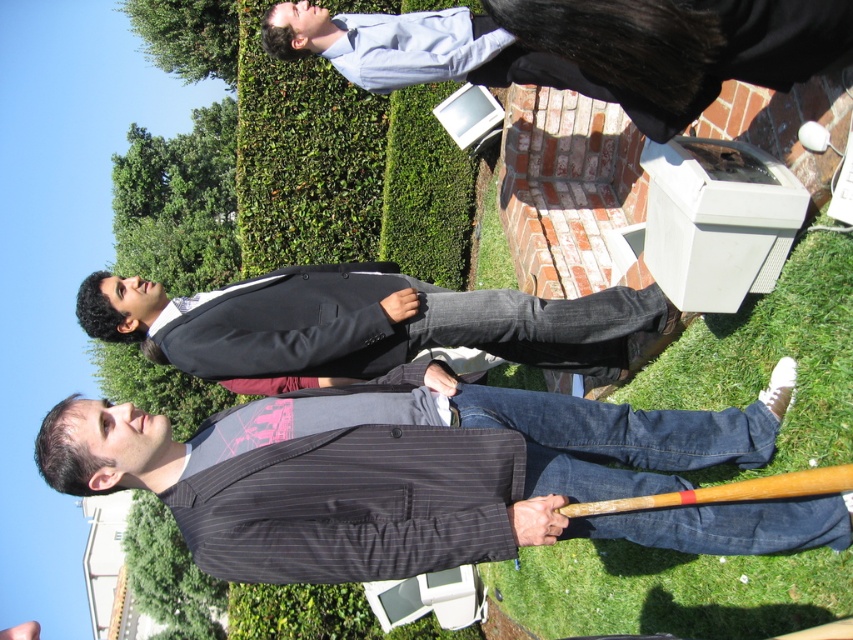
Identify the location of striped pinstripe suit at center. Image resolution: width=853 pixels, height=640 pixels. (422, 477).

Can you confirm if striped pinstripe suit at center is wider than light blue shirt at upper center?

Correct, the width of striped pinstripe suit at center exceeds that of light blue shirt at upper center.

At what (x,y) coordinates should I click in order to perform the action: click on striped pinstripe suit at center. Please return your answer as a coordinate pair (x, y). This screenshot has width=853, height=640. Looking at the image, I should click on (422, 477).

Looking at this image, is light blue shirt at upper center shorter than black pinstripe suit at center?

In fact, light blue shirt at upper center may be taller than black pinstripe suit at center.

In the scene shown: Can you confirm if light blue shirt at upper center is wider than black pinstripe suit at center?

Incorrect, light blue shirt at upper center's width does not surpass black pinstripe suit at center's.

Find the location of a particular element. Image resolution: width=853 pixels, height=640 pixels. light blue shirt at upper center is located at coordinates (582, 48).

You are a GUI agent. You are given a task and a screenshot of the screen. Output one action in this format:
    pyautogui.click(x=<x>, y=<y>)
    Task: Click on the light blue shirt at upper center
    The image size is (853, 640).
    Given the screenshot: What is the action you would take?
    pyautogui.click(x=582, y=48)

Which is more to the left, green grass at lower right or wooden baseball bat at lower center?

Positioned to the left is wooden baseball bat at lower center.

Does point (827, 577) lie behind point (750, 486)?

No, it is in front of (750, 486).

The image size is (853, 640). I want to click on green grass at lower right, so (669, 589).